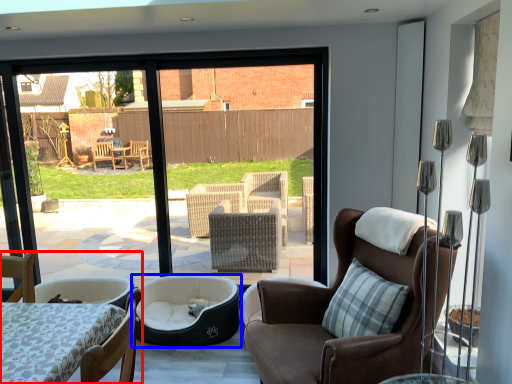
Question: Which object is closer to the camera taking this photo, chair (highlighted by a red box) or dog bed (highlighted by a blue box)?

Choices:
 (A) chair
 (B) dog bed

Answer: (A)